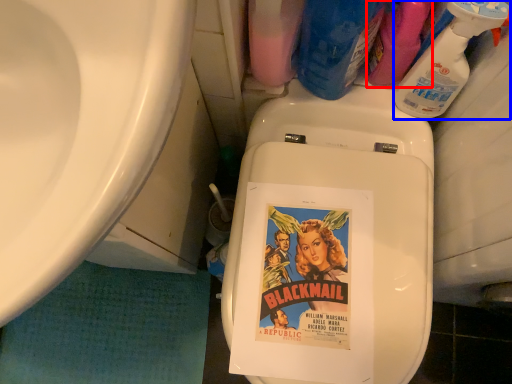
Question: Which object is closer to the camera taking this photo, cleaning product (highlighted by a red box) or cleaning product (highlighted by a blue box)?

Choices:
 (A) cleaning product
 (B) cleaning product

Answer: (B)